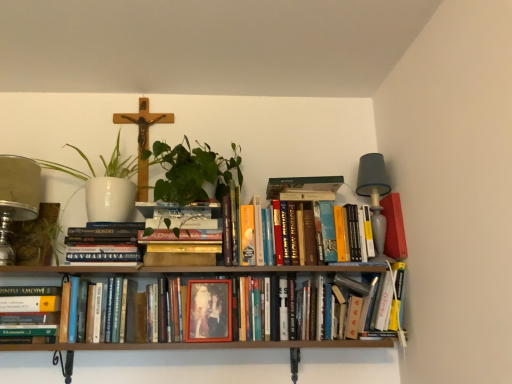
Question: Is wooden crucifix at upper center behind matte plastic photo frame at center, placed as the 1th paperback book when sorted from bottom to top?

Choices:
 (A) yes
 (B) no

Answer: (A)

Question: Can matte plastic photo frame at center, marked as the 1th paperback book in a front-to-back arrangement, be found inside wooden crucifix at upper center?

Choices:
 (A) yes
 (B) no

Answer: (B)

Question: From a real-world perspective, is wooden crucifix at upper center physically below matte plastic photo frame at center, which is counted as the 2th paperback book, starting from the back?

Choices:
 (A) no
 (B) yes

Answer: (A)

Question: Is the position of wooden crucifix at upper center less distant than that of matte plastic photo frame at center, the second paperback book viewed from the top?

Choices:
 (A) no
 (B) yes

Answer: (A)

Question: From the image's perspective, does wooden crucifix at upper center appear higher than matte plastic photo frame at center, marked as the 1th paperback book in a front-to-back arrangement?

Choices:
 (A) yes
 (B) no

Answer: (A)

Question: Does point (388, 248) appear closer or farther from the camera than point (378, 177)?

Choices:
 (A) farther
 (B) closer

Answer: (B)

Question: From the image's perspective, relative to gray fabric lampshade at upper right, arranged as the 2th table lamp when viewed from the left, is matte red paperback book at right, acting as the first paperback book starting from the right, above or below?

Choices:
 (A) above
 (B) below

Answer: (B)

Question: Considering the positions of matte red paperback book at right, which ranks as the 1th paperback book in back-to-front order, and gray fabric lampshade at upper right, marked as the 1th table lamp in a right-to-left arrangement, in the image, is matte red paperback book at right, which ranks as the 1th paperback book in back-to-front order, bigger or smaller than gray fabric lampshade at upper right, marked as the 1th table lamp in a right-to-left arrangement,?

Choices:
 (A) big
 (B) small

Answer: (B)

Question: Would you say matte red paperback book at right, positioned as the 2th paperback book in left-to-right order, is to the left or to the right of gray fabric lampshade at upper right, arranged as the 2th table lamp when viewed from the left, in the picture?

Choices:
 (A) left
 (B) right

Answer: (B)

Question: Is metallic glass table lamp at left, which ranks as the second table lamp in right-to-left order, spatially inside hardcover books at center, the third book viewed from the right, or outside of it?

Choices:
 (A) outside
 (B) inside

Answer: (A)

Question: Considering their positions, is metallic glass table lamp at left, the first table lamp from the left, located in front of or behind hardcover books at center, marked as the 2th book in a left-to-right arrangement?

Choices:
 (A) front
 (B) behind

Answer: (A)

Question: In terms of width, does metallic glass table lamp at left, which ranks as the second table lamp in right-to-left order, look wider or thinner when compared to hardcover books at center, the third book viewed from the right?

Choices:
 (A) thin
 (B) wide

Answer: (A)

Question: Is metallic glass table lamp at left, which ranks as the second table lamp in right-to-left order, taller or shorter than hardcover books at center, marked as the 2th book in a left-to-right arrangement?

Choices:
 (A) short
 (B) tall

Answer: (B)

Question: Considering the relative positions of wooden frame photo at center, arranged as the second book when viewed from the right, and gray fabric lampshade at upper right, arranged as the 2th table lamp when viewed from the left, in the image provided, is wooden frame photo at center, arranged as the second book when viewed from the right, to the left or to the right of gray fabric lampshade at upper right, arranged as the 2th table lamp when viewed from the left,?

Choices:
 (A) left
 (B) right

Answer: (A)

Question: Considering their positions, is wooden frame photo at center, arranged as the second book when viewed from the right, located in front of or behind gray fabric lampshade at upper right, marked as the 1th table lamp in a right-to-left arrangement?

Choices:
 (A) behind
 (B) front

Answer: (B)